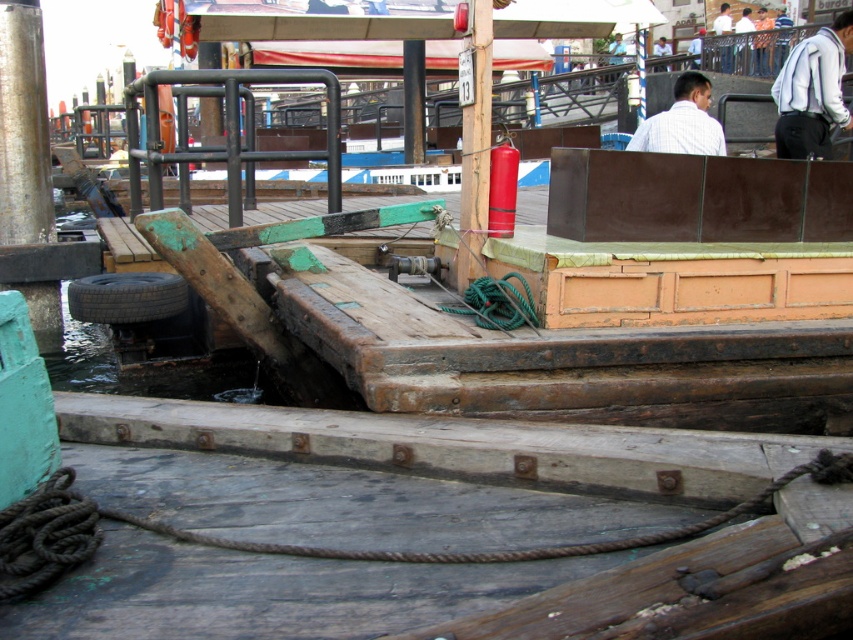
You are standing at the center of the dock and want to place a new mooring point for a small boat. The current mooring point is the black rubber tire at lower left. If you move 0.1 units to the right and 0.05 units up from the current mooring point, will you be on the wooden structure or in the water?

The new location after moving 0.1 units to the right and 0.05 units up from the black rubber tire at lower left would be at coordinates approximately [170,360]. Since the wooden structure is partially submerged and the tire is near it, moving right and slightly up might place you in the water. However, without exact depth or structure dimensions, it is uncertain. The answer cannot be definitively determined with the given information.

You are a photographer trying to capture both the white fabric shirt at upper right and the black rubber tire at lower left in a single frame. Which object should you focus on first to ensure both are in the frame without moving the camera?

You should focus on the white fabric shirt at upper right first because it is larger than the black rubber tire at lower left, ensuring it fits within the frame while the smaller tire will also be captured.